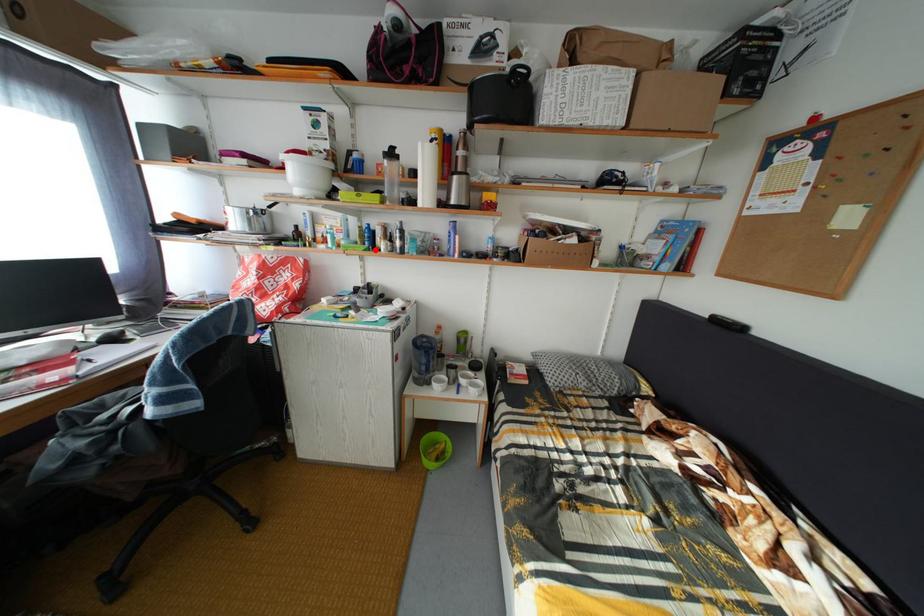
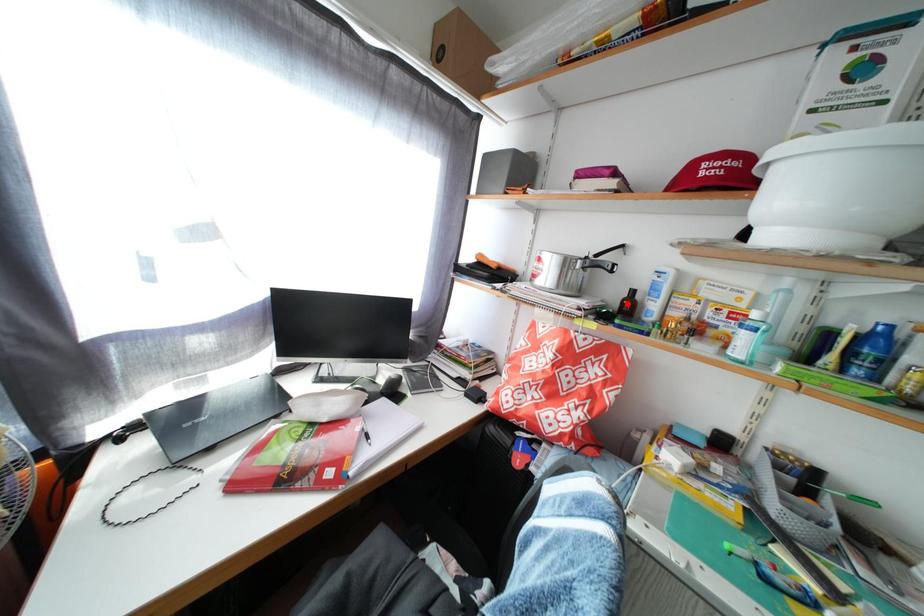
I am providing you with two images of the same scene from different viewpoints. A red point is marked on the first image and another point is marked on the second image. Do the highlighted points in image1 and image2 indicate the same real-world spot?

No